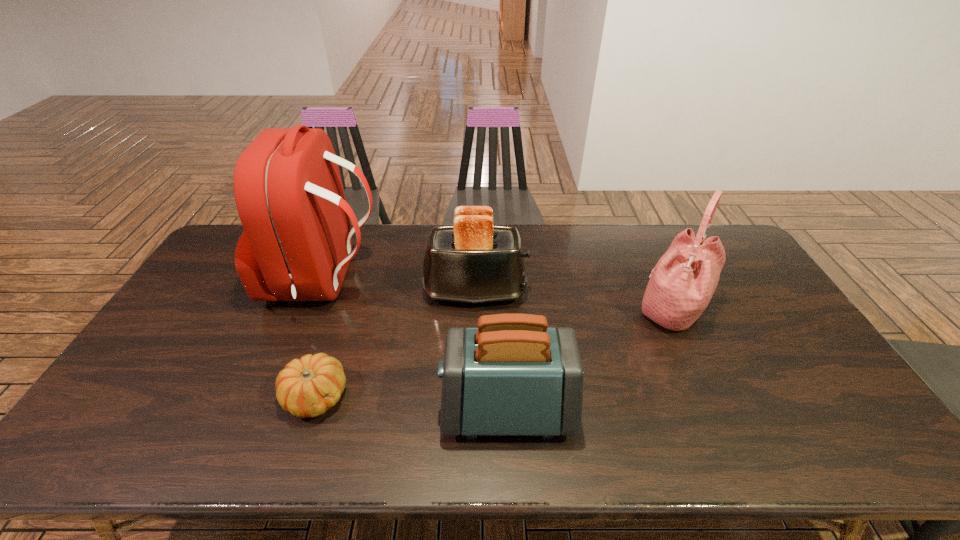
Locate an element on the screen. This screenshot has height=540, width=960. free space at the far right corner is located at coordinates (707, 236).

Find the location of a particular element. Image resolution: width=960 pixels, height=540 pixels. empty location between the farther toaster and the shortest object is located at coordinates (396, 345).

I want to click on vacant space that's between the farther toaster and the shortest object, so click(x=396, y=345).

Where is `unoccupied area between the shortest object and the nearer toaster`? unoccupied area between the shortest object and the nearer toaster is located at coordinates (411, 403).

Locate an element on the screen. free space between the shortest object and the tallest object is located at coordinates (321, 339).

Find the location of a particular element. This screenshot has height=540, width=960. free spot between the handbag and the farther toaster is located at coordinates (574, 301).

Locate an element on the screen. free space between the nearer toaster and the handbag is located at coordinates (590, 360).

At what (x,y) coordinates should I click in order to perform the action: click on unoccupied area between the farther toaster and the tallest object. Please return your answer as a coordinate pair (x, y). This screenshot has height=540, width=960. Looking at the image, I should click on (400, 286).

I want to click on free space between the backpack and the nearer toaster, so click(417, 345).

Locate which object is the second closest to the gourd. Please provide its 2D coordinates. Your answer should be formatted as a tuple, i.e. [(x, y)], where the tuple contains the x and y coordinates of a point satisfying the conditions above.

[(512, 375)]